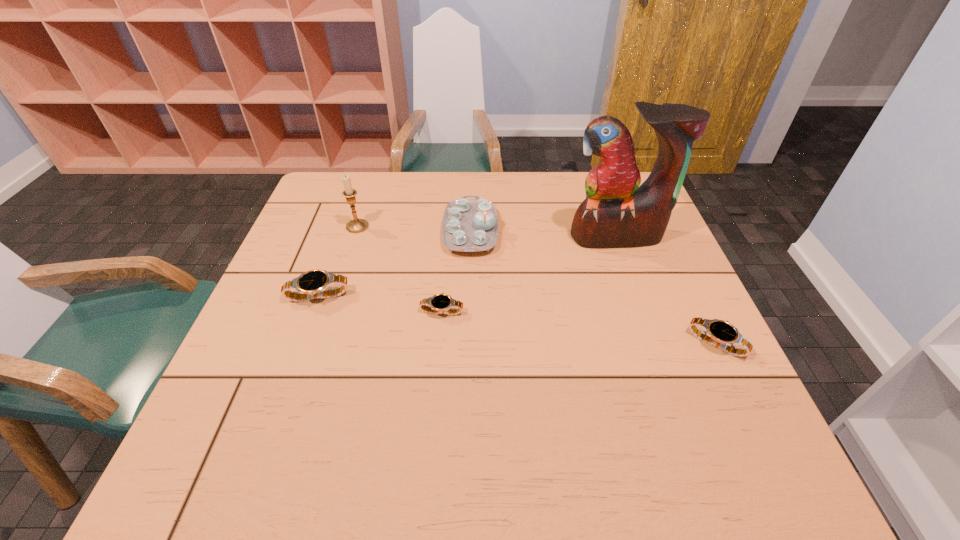
In the image, there is a desktop. Where is `free space at the far edge`? free space at the far edge is located at coordinates (385, 182).

The height and width of the screenshot is (540, 960). Find the location of `vacant space at the near edge of the desktop`. vacant space at the near edge of the desktop is located at coordinates (441, 395).

Find the location of `vacant space at the left edge of the desktop`. vacant space at the left edge of the desktop is located at coordinates (300, 254).

Where is `vacant space at the right edge`? vacant space at the right edge is located at coordinates (679, 368).

What are the coordinates of `free space at the far left corner of the desktop` in the screenshot? It's located at (325, 185).

The height and width of the screenshot is (540, 960). What are the coordinates of `vacant area between the second shortest object and the tallest object` in the screenshot? It's located at (666, 290).

Locate an element on the screen. unoccupied area between the fourth shortest object and the nearest object is located at coordinates (593, 287).

The image size is (960, 540). What are the coordinates of `free area in between the shortest object and the fifth shortest object` in the screenshot? It's located at (399, 269).

The image size is (960, 540). I want to click on vacant point located between the tallest watch and the second shortest watch, so click(x=516, y=320).

Find the location of a particular element. This screenshot has width=960, height=540. free space between the shortest watch and the tallest object is located at coordinates (529, 274).